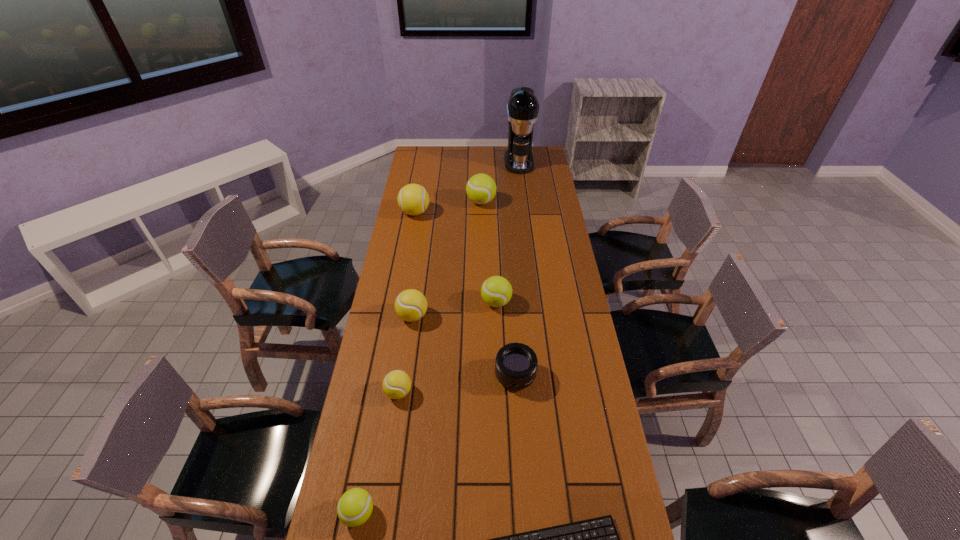
Image resolution: width=960 pixels, height=540 pixels. I want to click on the smallest green tennis ball, so pyautogui.click(x=354, y=508).

Image resolution: width=960 pixels, height=540 pixels. What are the coordinates of `vacant position located 0.190m place cup under the spout of the tallest object` in the screenshot? It's located at [523, 194].

Identify the location of vacant space positioned on the left of the farthest green tennis ball. This screenshot has width=960, height=540. (424, 202).

Where is `free spot located on the front of the biggest yellow tennis ball`? Image resolution: width=960 pixels, height=540 pixels. free spot located on the front of the biggest yellow tennis ball is located at coordinates (409, 248).

At what (x,y) coordinates should I click in order to perform the action: click on free space located on the front of the second farthest yellow tennis ball. Please return your answer as a coordinate pair (x, y). This screenshot has width=960, height=540. Looking at the image, I should click on (408, 350).

Identify the location of free space located on the left of the second farthest green tennis ball. The image size is (960, 540). (432, 302).

This screenshot has height=540, width=960. In order to click on vacant space situated 0.300m on the side of the telephoto lens with brand markings and control switches in this screenshot , I will do `click(523, 490)`.

Find the location of a particular element. vacant space situated 0.340m on the back of the nearest yellow tennis ball is located at coordinates (412, 305).

At what (x,y) coordinates should I click in order to perform the action: click on free location located 0.260m on the right of the smallest green tennis ball. Please return your answer as a coordinate pair (x, y). Image resolution: width=960 pixels, height=540 pixels. Looking at the image, I should click on (473, 514).

This screenshot has height=540, width=960. Identify the location of object that is at the far edge. (522, 109).